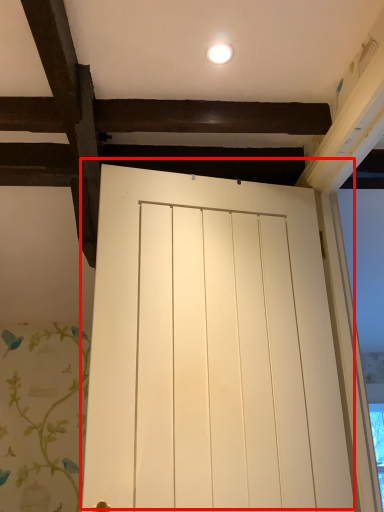
Question: From the image, what is the correct spatial relationship of door (annotated by the red box) in relation to lighting?

Choices:
 (A) right
 (B) left

Answer: (A)